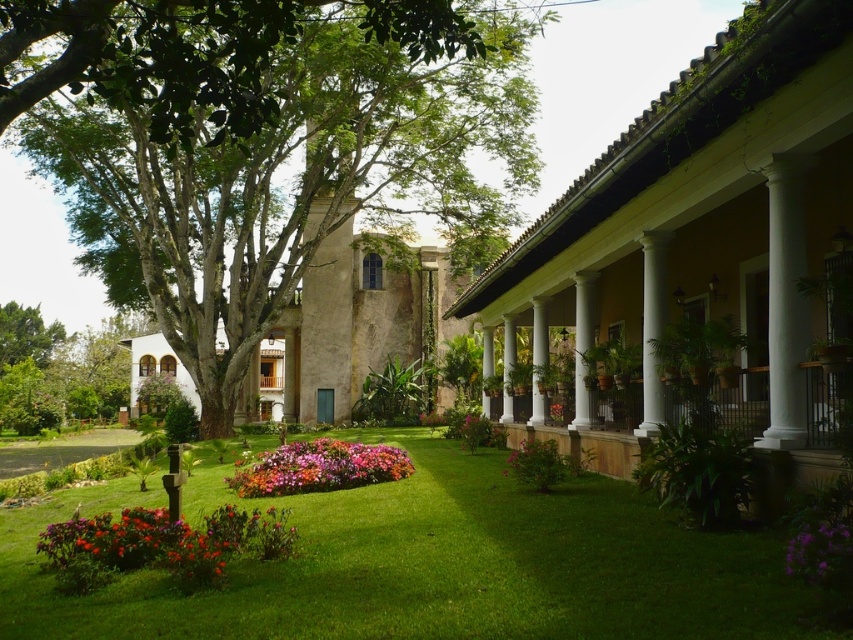
You are standing in the garden and want to take a photo of both the point at coordinates point (x=804, y=557) and the point at coordinates point (x=546, y=305). Which point should you focus on first to ensure both are in focus?

You should focus on the point at coordinates point (x=804, y=557) first because it is closer to the camera than the point at coordinates point (x=546, y=305). This ensures the closer point is in focus, and the farther point may also be within the depth of field.

You are standing in the garden and want to place a small statue on the green grass at lower center. Will the statue be visible from the top of the white glossy column at center?

The green grass at lower center is shorter than the white glossy column at center. Since the grass is shorter, the statue placed on it would likely be visible from the top of the column unless obstructed by other elements in the scene.

You are standing in the garden and want to take a photo of the green grass at lower center and the white glossy column at center. Which object should you focus on first to ensure both are in the frame?

You should focus on the white glossy column at center first because the green grass at lower center is in front of it, so adjusting the camera to include both would require framing from the front object backward.